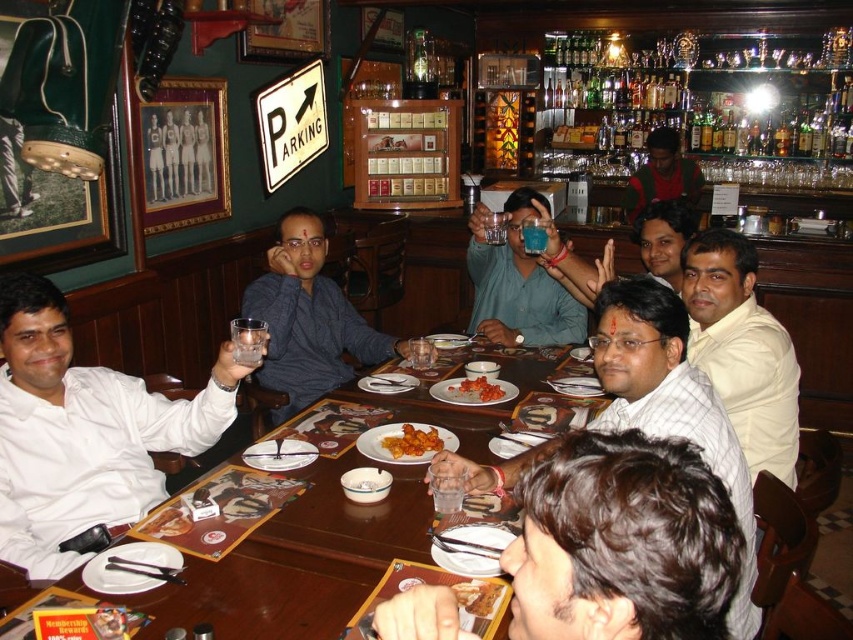
Based on the photo, who is shorter, matte blue glass at center or golden crispy pastry at center?

With less height is golden crispy pastry at center.

Which is behind, point (505, 218) or point (489, 605)?

The point (505, 218) is behind.

Where is `matte blue glass at center`? matte blue glass at center is located at coordinates (517, 284).

Who is shorter, matte blue glass at center or red shirt at bar right?

matte blue glass at center is shorter.

Consider the image. Is matte blue glass at center above red shirt at bar right?

No.

You are a GUI agent. You are given a task and a screenshot of the screen. Output one action in this format:
    pyautogui.click(x=<x>, y=<y>)
    Task: Click on the matte blue glass at center
    
    Given the screenshot: What is the action you would take?
    pyautogui.click(x=517, y=284)

Between point (405, 541) and point (460, 600), which one is positioned in front?

Point (460, 600) is more forward.

Where is `wooden table at center`? The image size is (853, 640). wooden table at center is located at coordinates (300, 561).